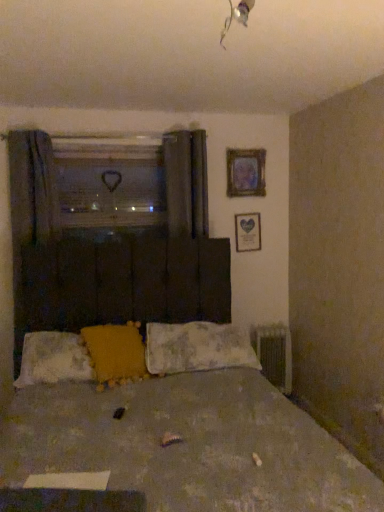
Question: Is metallic silver radiator at lower right at the back of matte glass picture frame at upper right, positioned as the 2th picture frame in bottom-to-top order?

Choices:
 (A) no
 (B) yes

Answer: (A)

Question: From the image's perspective, does matte glass picture frame at upper right, acting as the first picture frame starting from the top, appear lower than metallic silver radiator at lower right?

Choices:
 (A) yes
 (B) no

Answer: (B)

Question: Is matte glass picture frame at upper right, positioned as the 2th picture frame in bottom-to-top order, outside metallic silver radiator at lower right?

Choices:
 (A) no
 (B) yes

Answer: (B)

Question: Does matte glass picture frame at upper right, acting as the first picture frame starting from the top, have a lesser height compared to metallic silver radiator at lower right?

Choices:
 (A) no
 (B) yes

Answer: (B)

Question: Is metallic silver radiator at lower right surrounded by matte glass picture frame at upper right, positioned as the 2th picture frame in bottom-to-top order?

Choices:
 (A) yes
 (B) no

Answer: (B)

Question: Is matte glass picture frame at upper right, acting as the first picture frame starting from the top, closer to the viewer compared to metallic silver radiator at lower right?

Choices:
 (A) yes
 (B) no

Answer: (A)

Question: Is wooden heart-shaped frame at upper right, the second picture frame from the top, outside of matte glass picture frame at upper right, acting as the first picture frame starting from the top?

Choices:
 (A) yes
 (B) no

Answer: (A)

Question: Would you say matte glass picture frame at upper right, positioned as the 2th picture frame in bottom-to-top order, is part of wooden heart-shaped frame at upper right, which is the 1th picture frame in bottom-to-top order,'s contents?

Choices:
 (A) yes
 (B) no

Answer: (B)

Question: Can you confirm if wooden heart-shaped frame at upper right, the second picture frame from the top, is positioned to the left of matte glass picture frame at upper right, positioned as the 2th picture frame in bottom-to-top order?

Choices:
 (A) yes
 (B) no

Answer: (B)

Question: Is wooden heart-shaped frame at upper right, which is the 1th picture frame in bottom-to-top order, facing away from matte glass picture frame at upper right, acting as the first picture frame starting from the top?

Choices:
 (A) no
 (B) yes

Answer: (A)

Question: Is wooden heart-shaped frame at upper right, which is the 1th picture frame in bottom-to-top order, further to the viewer compared to matte glass picture frame at upper right, positioned as the 2th picture frame in bottom-to-top order?

Choices:
 (A) no
 (B) yes

Answer: (B)

Question: Is wooden heart-shaped frame at upper right, the second picture frame from the top, shorter than matte glass picture frame at upper right, acting as the first picture frame starting from the top?

Choices:
 (A) yes
 (B) no

Answer: (A)

Question: Is clear plastic heart at upper center placed right next to matte glass picture frame at upper right, acting as the first picture frame starting from the top?

Choices:
 (A) no
 (B) yes

Answer: (A)